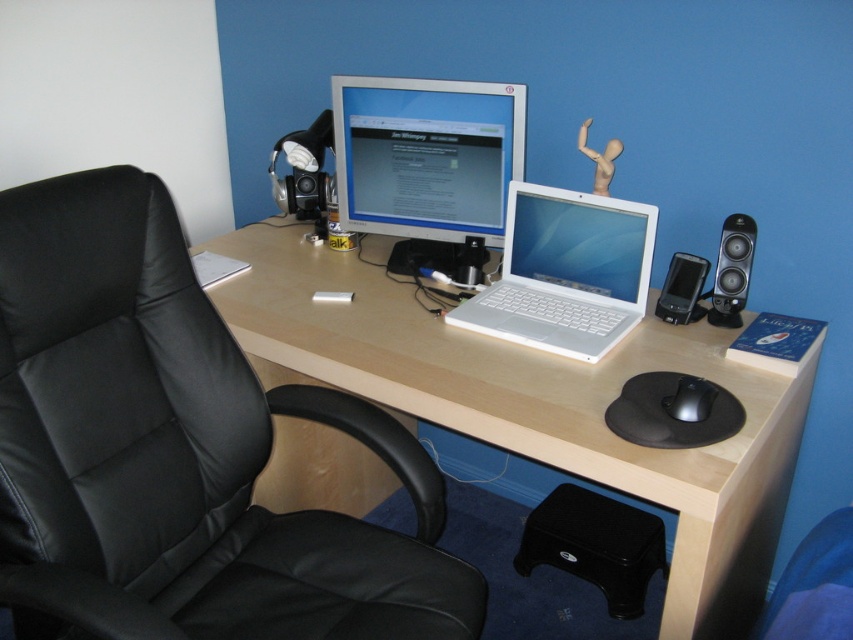
Find the location of a particular element. light wood/woodendesk at center is located at coordinates (534, 404).

Measure the distance between point (653,488) and camera.

The distance of point (653,488) from camera is 3.82 feet.

Find the location of a particular element. light wood/woodendesk at center is located at coordinates (534, 404).

Between white glossy laptop at center and black plastic speaker at right, which one has less height?

Standing shorter between the two is black plastic speaker at right.

Where is `white glossy laptop at center`? white glossy laptop at center is located at coordinates (566, 273).

Does point (189, 314) come behind point (633, 269)?

No, (189, 314) is closer to viewer.

Which is behind, point (22, 371) or point (616, 284)?

The point (616, 284) is behind.

Identify the location of black leather swivel chair at left. pos(177,451).